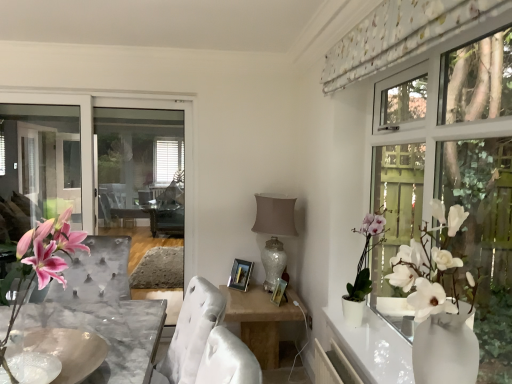
Question: Would you say white floral fabric at upper right is outside white ceramic plant at upper right?

Choices:
 (A) no
 (B) yes

Answer: (B)

Question: Is white floral fabric at upper right not near white ceramic plant at upper right?

Choices:
 (A) yes
 (B) no

Answer: (A)

Question: From the image's perspective, is white floral fabric at upper right beneath white ceramic plant at upper right?

Choices:
 (A) no
 (B) yes

Answer: (A)

Question: Is white floral fabric at upper right at the left side of white ceramic plant at upper right?

Choices:
 (A) no
 (B) yes

Answer: (B)

Question: Can you confirm if white floral fabric at upper right is shorter than white ceramic plant at upper right?

Choices:
 (A) no
 (B) yes

Answer: (B)

Question: Considering their positions, is satin beige table at center located in front of or behind marble bowl at center?

Choices:
 (A) behind
 (B) front

Answer: (A)

Question: In terms of size, does satin beige table at center appear bigger or smaller than marble bowl at center?

Choices:
 (A) big
 (B) small

Answer: (A)

Question: Based on their positions, is satin beige table at center located to the left or right of marble bowl at center?

Choices:
 (A) left
 (B) right

Answer: (B)

Question: Considering the positions of point (266, 306) and point (40, 332), is point (266, 306) closer or farther from the camera than point (40, 332)?

Choices:
 (A) closer
 (B) farther

Answer: (B)

Question: From the image's perspective, is white glossy lamp at center positioned above or below white floral fabric at upper right?

Choices:
 (A) below
 (B) above

Answer: (A)

Question: Looking at the image, does white glossy lamp at center seem bigger or smaller compared to white floral fabric at upper right?

Choices:
 (A) small
 (B) big

Answer: (B)

Question: Is point (267, 286) positioned closer to the camera than point (343, 59)?

Choices:
 (A) farther
 (B) closer

Answer: (A)

Question: Is white glossy lamp at center situated inside white floral fabric at upper right or outside?

Choices:
 (A) inside
 (B) outside

Answer: (B)

Question: Is white floral fabric at upper right wider or thinner than white glossy lamp at center?

Choices:
 (A) wide
 (B) thin

Answer: (B)

Question: From the image's perspective, is white floral fabric at upper right above or below white glossy lamp at center?

Choices:
 (A) above
 (B) below

Answer: (A)